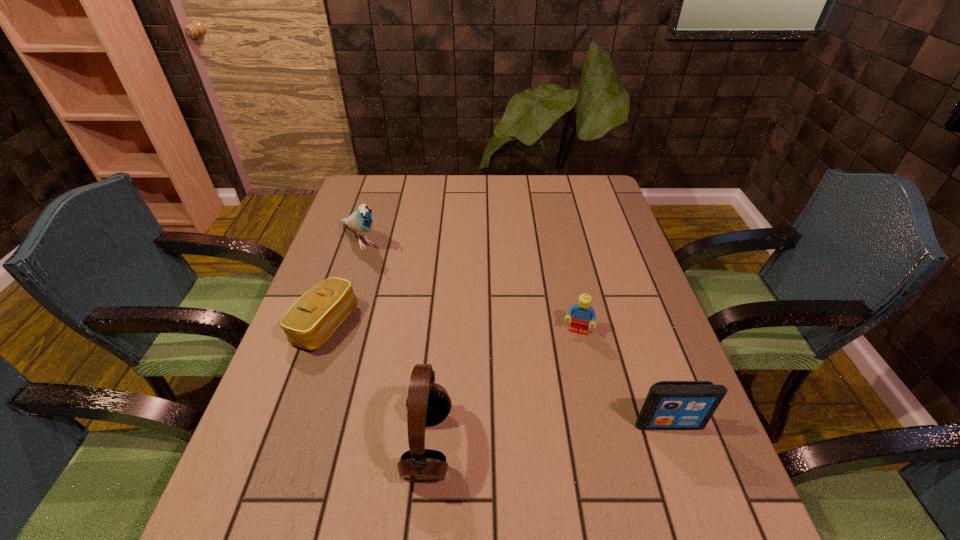
Locate an element on the screen. The width and height of the screenshot is (960, 540). vacant space located 0.150m on the face of the Lego is located at coordinates (562, 389).

Where is `vacant area located at the face of the farthest object`? vacant area located at the face of the farthest object is located at coordinates pos(384,267).

At what (x,y) coordinates should I click in order to perform the action: click on vacant point located at the face of the farthest object. Please return your answer as a coordinate pair (x, y). Looking at the image, I should click on (447, 330).

The image size is (960, 540). In order to click on vacant space located 0.260m at the face of the farthest object in this screenshot , I will do `click(420, 303)`.

The image size is (960, 540). I want to click on vacant position located on the zipper side of the clutch bag, so click(x=452, y=385).

Where is `vacant space positioned on the zipper side of the clutch bag`? vacant space positioned on the zipper side of the clutch bag is located at coordinates (465, 390).

Locate an element on the screen. This screenshot has width=960, height=540. vacant area situated on the zipper side of the clutch bag is located at coordinates (477, 396).

The image size is (960, 540). In order to click on object that is at the near edge in this screenshot , I will do `click(428, 403)`.

Find the location of a particular element. bird that is at the left edge is located at coordinates (360, 221).

Locate an element on the screen. clutch bag present at the left edge is located at coordinates (311, 320).